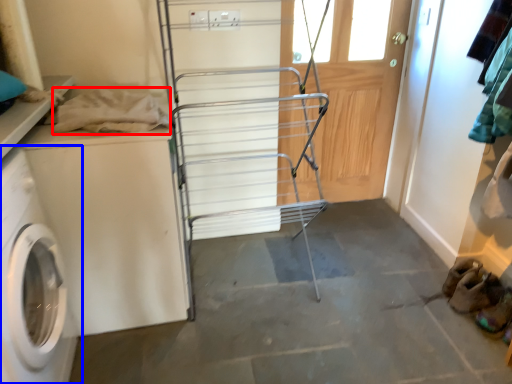
Question: Which object appears closest to the camera in this image, clothing (highlighted by a red box) or washing machine (highlighted by a blue box)?

Choices:
 (A) clothing
 (B) washing machine

Answer: (B)